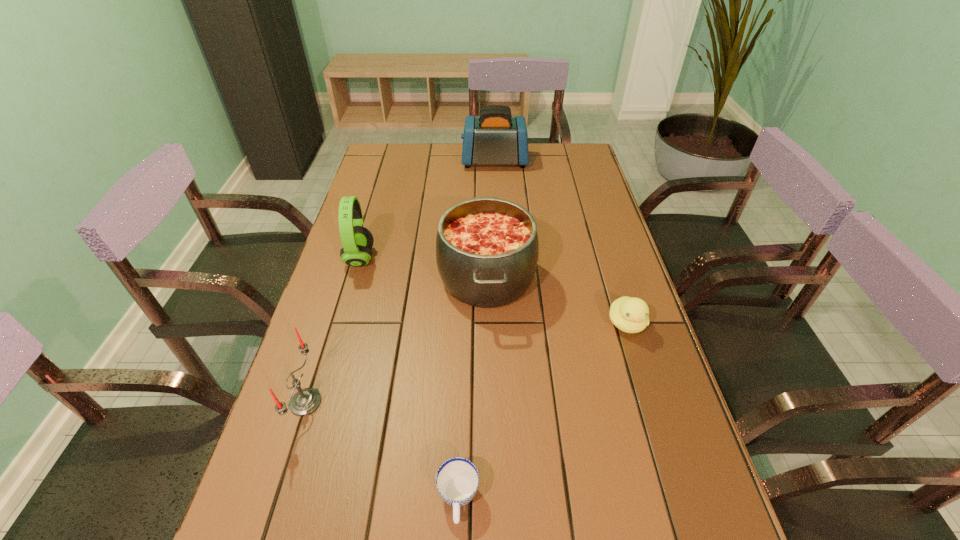
I want to click on free space at the left edge of the desktop, so click(393, 194).

The height and width of the screenshot is (540, 960). I want to click on free space at the right edge of the desktop, so click(x=622, y=265).

Image resolution: width=960 pixels, height=540 pixels. In the image, there is a desktop. In order to click on vacant space at the far left corner in this screenshot , I will do `click(407, 147)`.

Image resolution: width=960 pixels, height=540 pixels. I want to click on free area in between the candle and the shortest object, so click(x=382, y=450).

Identify the location of blank region between the duckling and the cup. (542, 411).

Locate an element on the screen. vacant space that's between the shortest object and the farthest object is located at coordinates (476, 330).

Locate an element on the screen. empty space that is in between the casserole and the second nearest object is located at coordinates (396, 340).

Identify the location of blank region between the second shortest object and the casserole. (557, 301).

The height and width of the screenshot is (540, 960). I want to click on blank region between the nearest object and the headset, so click(x=409, y=379).

Identify the location of unoccupied area between the headset and the casserole. (423, 268).